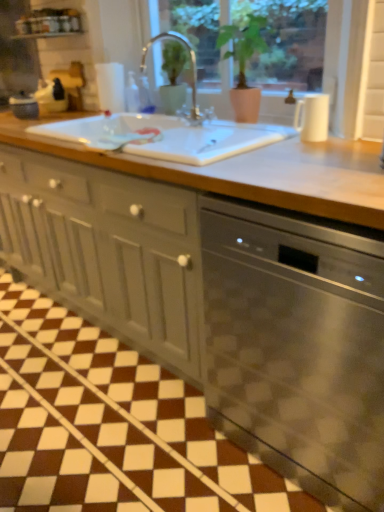
Image resolution: width=384 pixels, height=512 pixels. In order to click on free spot to the left of stainless steel dishwasher at center in this screenshot , I will do `click(153, 441)`.